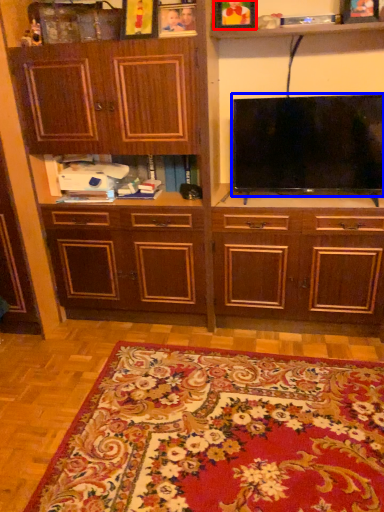
Question: Which object appears closest to the camera in this image, picture frame (highlighted by a red box) or television (highlighted by a blue box)?

Choices:
 (A) picture frame
 (B) television

Answer: (B)